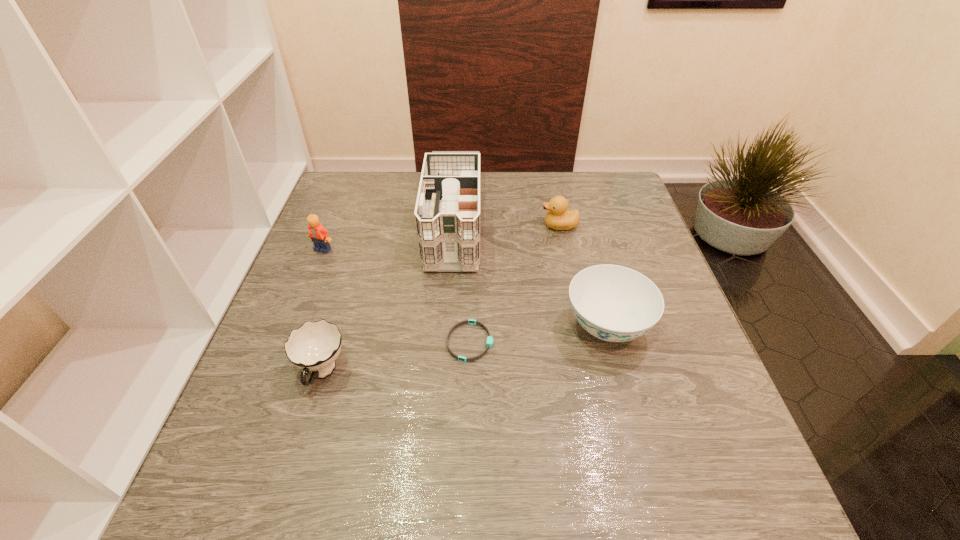
Identify the location of free spot between the duckling and the fifth object from right to left. The image size is (960, 540). (441, 299).

Where is `free spot between the fifth object from right to left and the tallest object`? Image resolution: width=960 pixels, height=540 pixels. free spot between the fifth object from right to left and the tallest object is located at coordinates (388, 295).

You are a GUI agent. You are given a task and a screenshot of the screen. Output one action in this format:
    pyautogui.click(x=<x>, y=<y>)
    Task: Click on the free space between the cup and the wristband
    
    Given the screenshot: What is the action you would take?
    pyautogui.click(x=396, y=357)

The image size is (960, 540). I want to click on object identified as the closest to the chinaware, so click(x=489, y=342).

This screenshot has width=960, height=540. What are the coordinates of `object that is the closest to the shortest object` in the screenshot? It's located at (447, 214).

Identify the location of vacant region that satisfies the following two spatial constraints: 1. on the front-facing side of the chinaware; 2. on the right side of the Lego. (293, 326).

Locate an element on the screen. This screenshot has height=540, width=960. blank area in the image that satisfies the following two spatial constraints: 1. facing forward on the duckling; 2. on the side of the second object from left to right with the handle is located at coordinates (590, 373).

The width and height of the screenshot is (960, 540). Identify the location of vacant space that satisfies the following two spatial constraints: 1. facing forward on the duckling; 2. on the front-facing side of the leftmost object. (564, 249).

Image resolution: width=960 pixels, height=540 pixels. I want to click on free space in the image that satisfies the following two spatial constraints: 1. facing forward on the duckling; 2. on the front-facing side of the leftmost object, so click(564, 249).

Identify the location of free space that satisfies the following two spatial constraints: 1. at the entrance of the chinaware; 2. on the right side of the dollhouse. This screenshot has height=540, width=960. (445, 326).